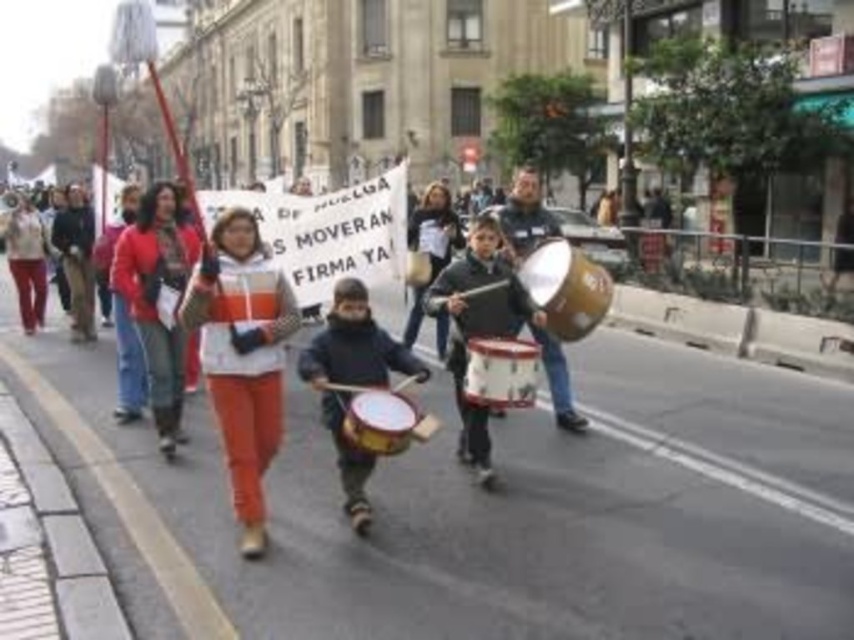
Question: Can you confirm if matte brown drum at center is wider than dark brown leather jacket at center?

Choices:
 (A) yes
 (B) no

Answer: (B)

Question: Which point appears closest to the camera in this image?

Choices:
 (A) (344, 195)
 (B) (446, 316)

Answer: (B)

Question: Does matte yellow drum at center appear over white drum at center?

Choices:
 (A) no
 (B) yes

Answer: (B)

Question: Which of the following is the farthest from the observer?

Choices:
 (A) dark brown leather jacket at center
 (B) matte black drum at center

Answer: (A)

Question: Is white fleece jacket at center below matte red jacket at center?

Choices:
 (A) yes
 (B) no

Answer: (A)

Question: Which object is closer to the camera taking this photo?

Choices:
 (A) matte yellow drum at center
 (B) dark brown leather jacket at center

Answer: (A)